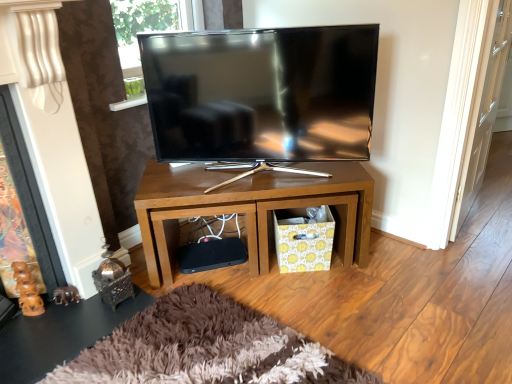
I want to click on wooden tv stand at center, so click(x=247, y=196).

The height and width of the screenshot is (384, 512). Describe the element at coordinates (112, 279) in the screenshot. I see `polished metal lantern at lower left` at that location.

The image size is (512, 384). I want to click on yellow floral cardboard crate at lower center, so click(304, 239).

Image resolution: width=512 pixels, height=384 pixels. Describe the element at coordinates (59, 335) in the screenshot. I see `shiny metallic side table at lower left` at that location.

You are a GUI agent. You are given a task and a screenshot of the screen. Output one action in this format:
    pyautogui.click(x=<x>, y=<y>)
    Task: Click on the transparent glass door at right
    The width and height of the screenshot is (512, 384).
    Given the screenshot: What is the action you would take?
    pyautogui.click(x=483, y=110)

Describe the element at coordinates (262, 93) in the screenshot. I see `matte black tv at center` at that location.

What do you see at coordinates (29, 194) in the screenshot?
I see `brown wood fireplace at left` at bounding box center [29, 194].

At what (x,y) coordinates should I click in order to perform the action: click on wooden tv stand at center. Please return your answer as a coordinate pair (x, y). Image resolution: width=512 pixels, height=384 pixels. Looking at the image, I should click on (247, 196).

From a real-world perspective, is wooden tv stand at center physically above brown wood fireplace at left?

Incorrect, from a real-world perspective, wooden tv stand at center is lower than brown wood fireplace at left.

This screenshot has height=384, width=512. I want to click on desk located underneath the brown wood fireplace at left (from a real-world perspective), so click(247, 196).

Does point (329, 181) lie in front of point (30, 172)?

No, it is not.

Is wooden tv stand at center not inside brown wood fireplace at left?

That's correct, wooden tv stand at center is outside of brown wood fireplace at left.

From a real-world perspective, which is physically above, wooden tv stand at center or polished metal lantern at lower left?

From a 3D spatial view, wooden tv stand at center is above.

Which is farther from the camera, (267,175) or (126,278)?

Point (267,175)

From the image's perspective, is wooden tv stand at center beneath polished metal lantern at lower left?

Actually, wooden tv stand at center appears above polished metal lantern at lower left in the image.

Can you confirm if wooden tv stand at center is bigger than polished metal lantern at lower left?

Indeed, wooden tv stand at center has a larger size compared to polished metal lantern at lower left.

Which object is further away from the camera taking this photo, brown wood fireplace at left or shiny metallic side table at lower left?

shiny metallic side table at lower left is further away from the camera.

Considering the relative sizes of brown wood fireplace at left and shiny metallic side table at lower left in the image provided, is brown wood fireplace at left bigger than shiny metallic side table at lower left?

Yes.

Between brown wood fireplace at left and shiny metallic side table at lower left, which one appears on the right side from the viewer's perspective?

From the viewer's perspective, shiny metallic side table at lower left appears more on the right side.

In terms of height, does brown wood fireplace at left look taller or shorter compared to shiny metallic side table at lower left?

brown wood fireplace at left is taller than shiny metallic side table at lower left.

From the image's perspective, is transparent glass door at right below brown wood fireplace at left?

No, from the image's perspective, transparent glass door at right is not beneath brown wood fireplace at left.

From a real-world perspective, which object stands above the other?

transparent glass door at right.

Considering the sizes of objects transparent glass door at right and brown wood fireplace at left in the image provided, who is shorter, transparent glass door at right or brown wood fireplace at left?

Standing shorter between the two is brown wood fireplace at left.

From a real-world perspective, is yellow floral cardboard crate at lower center below transparent glass door at right?

Correct, in the physical world, yellow floral cardboard crate at lower center is lower than transparent glass door at right.

Which is more to the right, yellow floral cardboard crate at lower center or transparent glass door at right?

Positioned to the right is transparent glass door at right.

From the image's perspective, between yellow floral cardboard crate at lower center and transparent glass door at right, who is located below?

From the image's view, yellow floral cardboard crate at lower center is below.

From a real-world perspective, is brown wood fireplace at left positioned under transparent glass door at right based on gravity?

Yes.

Measure the distance from brown wood fireplace at left to transparent glass door at right.

A distance of 6.42 feet exists between brown wood fireplace at left and transparent glass door at right.

Is brown wood fireplace at left taller or shorter than transparent glass door at right?

Clearly, brown wood fireplace at left is shorter compared to transparent glass door at right.

Considering the sizes of objects brown wood fireplace at left and transparent glass door at right in the image provided, who is smaller, brown wood fireplace at left or transparent glass door at right?

brown wood fireplace at left is smaller.

Is shiny metallic side table at lower left positioned with its back to yellow floral cardboard crate at lower center?

No.

Is shiny metallic side table at lower left bigger or smaller than yellow floral cardboard crate at lower center?

Clearly, shiny metallic side table at lower left is smaller in size than yellow floral cardboard crate at lower center.

Considering the relative positions of shiny metallic side table at lower left and yellow floral cardboard crate at lower center in the image provided, is shiny metallic side table at lower left to the right of yellow floral cardboard crate at lower center from the viewer's perspective?

No.

The image size is (512, 384). In order to click on crate on the right side of shiny metallic side table at lower left in this screenshot , I will do `click(304, 239)`.

This screenshot has width=512, height=384. In order to click on fireplace on the left side of wooden tv stand at center in this screenshot , I will do (x=29, y=194).

This screenshot has width=512, height=384. I want to click on desk located above the polished metal lantern at lower left (from the image's perspective), so click(x=247, y=196).

Considering their positions, is yellow floral cardboard crate at lower center positioned further to brown wood fireplace at left than polished metal lantern at lower left?

yellow floral cardboard crate at lower center.

Looking at the image, which one is located closer to polished metal lantern at lower left, matte black tv at center or wooden tv stand at center?

Among the two, wooden tv stand at center is located nearer to polished metal lantern at lower left.

In the scene shown: Looking at the image, which one is located closer to shiny metallic side table at lower left, transparent glass door at right or brown wood fireplace at left?

brown wood fireplace at left.

Estimate the real-world distances between objects in this image. Which object is further from polished metal lantern at lower left, brown wood fireplace at left or wooden tv stand at center?

Based on the image, wooden tv stand at center appears to be further to polished metal lantern at lower left.

Looking at this image, which object lies further to the anchor point polished metal lantern at lower left, yellow floral cardboard crate at lower center or matte black tv at center?

matte black tv at center is further to polished metal lantern at lower left.

Which object lies nearer to the anchor point transparent glass door at right, shiny metallic side table at lower left or yellow floral cardboard crate at lower center?

yellow floral cardboard crate at lower center is positioned closer to the anchor transparent glass door at right.

Estimate the real-world distances between objects in this image. Which object is further from brown wood fireplace at left, polished metal lantern at lower left or wooden tv stand at center?

Based on the image, wooden tv stand at center appears to be further to brown wood fireplace at left.

Estimate the real-world distances between objects in this image. Which object is further from polished metal lantern at lower left, shiny metallic side table at lower left or matte black tv at center?

The object further to polished metal lantern at lower left is matte black tv at center.

Identify the location of television between brown wood fireplace at left and yellow floral cardboard crate at lower center. (262, 93).

Find the location of a particular element. toy between brown wood fireplace at left and matte black tv at center is located at coordinates (112, 279).

At what (x,y) coordinates should I click in order to perform the action: click on desk between matte black tv at center and yellow floral cardboard crate at lower center vertically. Please return your answer as a coordinate pair (x, y). This screenshot has width=512, height=384. Looking at the image, I should click on (247, 196).

Locate an element on the screen. desk between brown wood fireplace at left and transparent glass door at right is located at coordinates (247, 196).